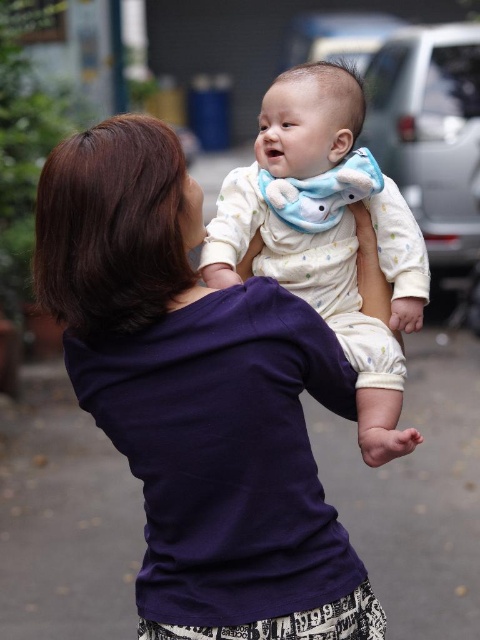
You are a fashion designer observing the scene. You notice the purple cotton shirt at center and the white dotted fabric at center. Which one do you think has a larger surface area?

The purple cotton shirt at center has a larger surface area than the white dotted fabric at center because it is bigger.

What are the coordinates of the purple cotton shirt at center in the image?

The purple cotton shirt at center is located at coordinates point (x=197, y=397).